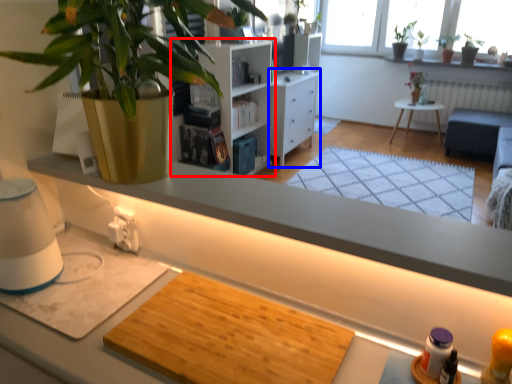
Question: Which object appears farthest to the camera in this image, shelf (highlighted by a red box) or cabinetry (highlighted by a blue box)?

Choices:
 (A) shelf
 (B) cabinetry

Answer: (B)